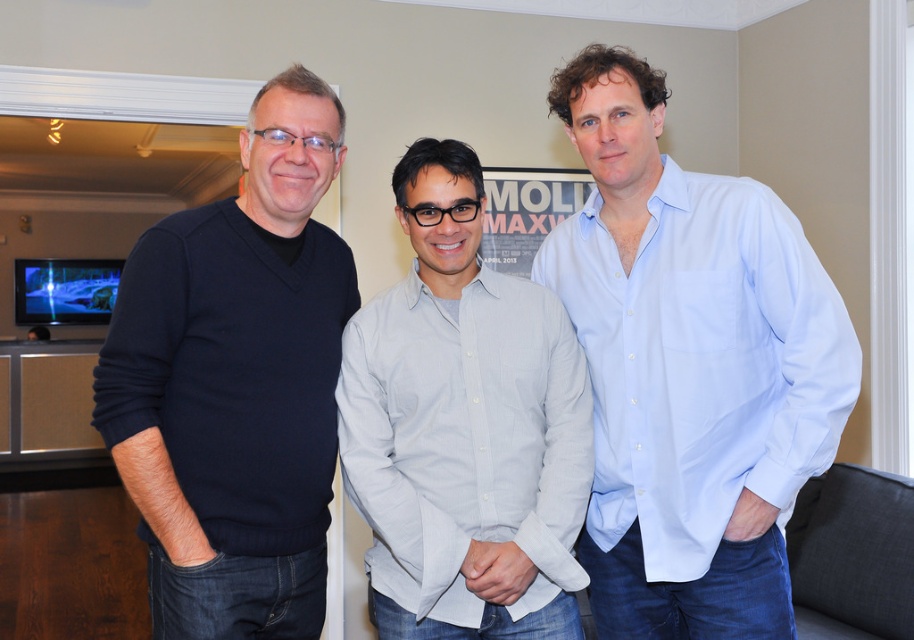
Question: Is dark blue sweater at left to the right of light gray cotton shirt at center from the viewer's perspective?

Choices:
 (A) no
 (B) yes

Answer: (A)

Question: Can you confirm if light blue cotton shirt at center is wider than light gray cotton shirt at center?

Choices:
 (A) no
 (B) yes

Answer: (B)

Question: Does dark blue sweater at left appear under light gray cotton shirt at center?

Choices:
 (A) no
 (B) yes

Answer: (A)

Question: Estimate the real-world distances between objects in this image. Which object is closer to the dark blue sweater at left?

Choices:
 (A) light gray cotton shirt at center
 (B) light blue cotton shirt at center

Answer: (A)

Question: Considering the real-world distances, which object is farthest from the dark blue sweater at left?

Choices:
 (A) light gray cotton shirt at center
 (B) light blue cotton shirt at center

Answer: (B)

Question: Estimate the real-world distances between objects in this image. Which object is farther from the dark blue sweater at left?

Choices:
 (A) light gray cotton shirt at center
 (B) light blue cotton shirt at center

Answer: (B)